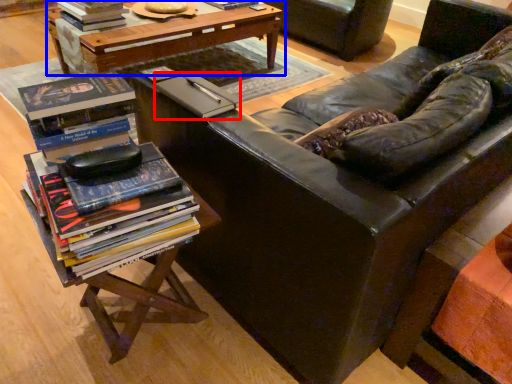
Question: Which object is closer to the camera taking this photo, paperback book (highlighted by a red box) or table (highlighted by a blue box)?

Choices:
 (A) paperback book
 (B) table

Answer: (A)